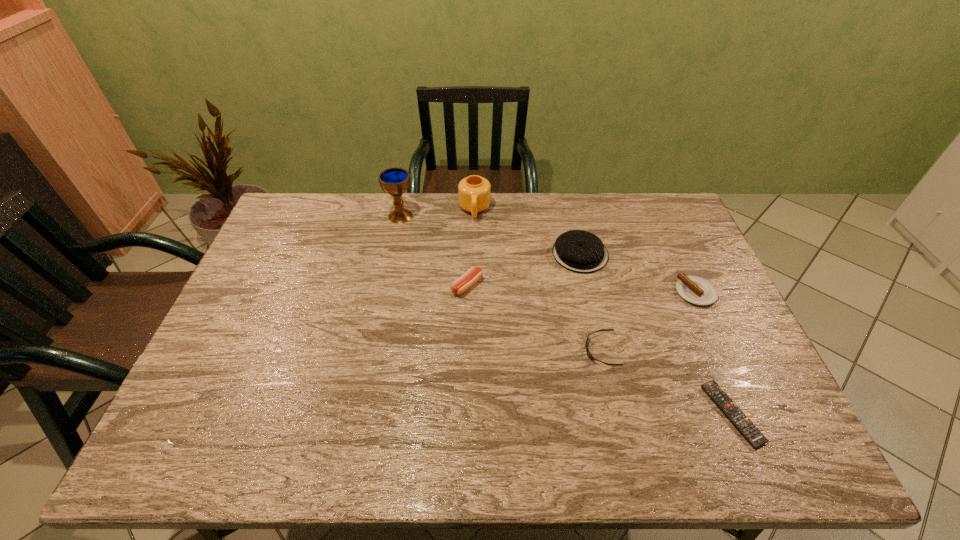
At what (x,y) coordinates should I click in order to perform the action: click on the tallest object. Please return your answer as a coordinate pair (x, y). This screenshot has width=960, height=540. Looking at the image, I should click on click(x=395, y=181).

The height and width of the screenshot is (540, 960). What are the coordinates of `chalice` in the screenshot? It's located at (395, 181).

I want to click on the second tallest object, so click(x=474, y=191).

Where is `the fifth shortest object`? the fifth shortest object is located at coordinates (580, 251).

The width and height of the screenshot is (960, 540). Identify the location of the fourth shortest object. tap(470, 277).

Find the location of a particular element. This screenshot has height=540, width=960. the taller sausage is located at coordinates (470, 277).

This screenshot has height=540, width=960. What are the coordinates of `the shorter sausage` in the screenshot? It's located at [694, 289].

The height and width of the screenshot is (540, 960). I want to click on the right sausage, so click(x=694, y=289).

This screenshot has width=960, height=540. I want to click on sunglasses, so click(589, 354).

I want to click on the sixth tallest object, so click(589, 354).